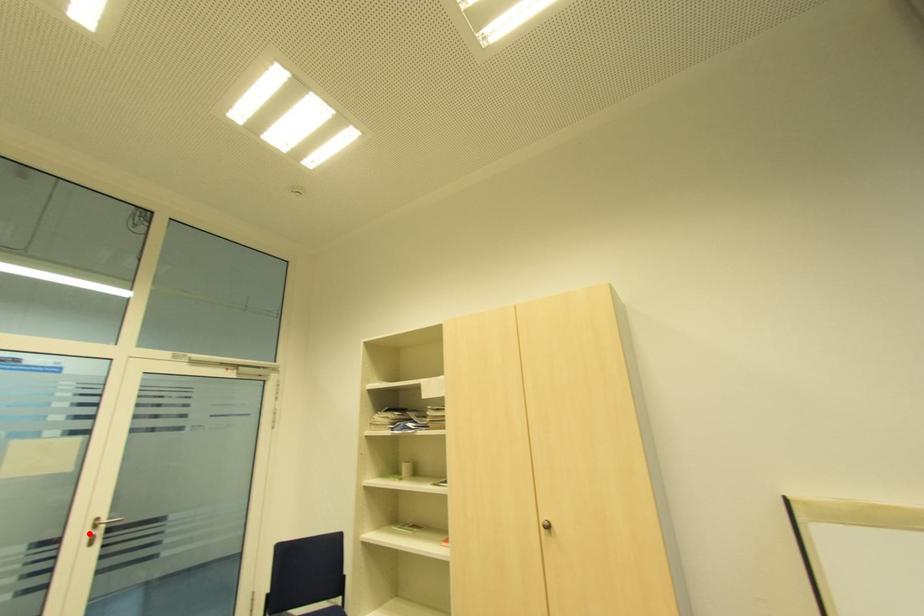
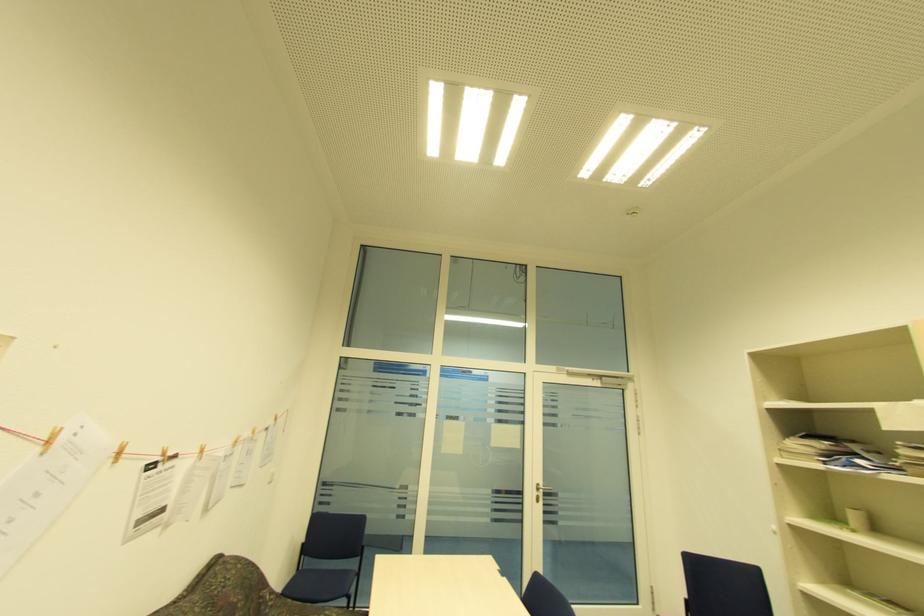
Question: I am providing you with two images of the same scene from different viewpoints. A red point is shown in image1. For the corresponding object point in image2, is it positioned nearer or farther from the camera?

Choices:
 (A) Nearer
 (B) Farther

Answer: (B)